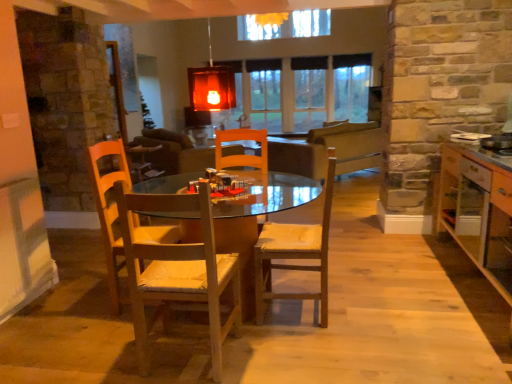
Question: Could clear glass window at center be considered to be inside wooden table at center?

Choices:
 (A) no
 (B) yes

Answer: (A)

Question: Is wooden table at center not close to clear glass window at center?

Choices:
 (A) yes
 (B) no

Answer: (A)

Question: From the image's perspective, would you say wooden table at center is positioned over clear glass window at center?

Choices:
 (A) yes
 (B) no

Answer: (B)

Question: Does wooden table at center have a smaller size compared to clear glass window at center?

Choices:
 (A) no
 (B) yes

Answer: (A)

Question: Does wooden table at center have a greater height compared to clear glass window at center?

Choices:
 (A) yes
 (B) no

Answer: (B)

Question: Is wooden table at center to the left or to the right of wooden chair with cushion at center, positioned as the 1th chair in right-to-left order, in the image?

Choices:
 (A) right
 (B) left

Answer: (B)

Question: Considering their positions, is wooden table at center located in front of or behind wooden chair with cushion at center, positioned as the 1th chair in right-to-left order?

Choices:
 (A) behind
 (B) front

Answer: (B)

Question: From the image's perspective, is wooden table at center positioned above or below wooden chair with cushion at center, positioned as the 1th chair in right-to-left order?

Choices:
 (A) below
 (B) above

Answer: (A)

Question: Would you say wooden table at center is inside or outside wooden chair with cushion at center, positioned as the 1th chair in right-to-left order?

Choices:
 (A) outside
 (B) inside

Answer: (A)

Question: In terms of size, does clear glass window at center appear bigger or smaller than wooden chair at center, the first chair viewed from the left?

Choices:
 (A) small
 (B) big

Answer: (B)

Question: From the image's perspective, is clear glass window at center located above or below wooden chair at center, marked as the second chair in a right-to-left arrangement?

Choices:
 (A) above
 (B) below

Answer: (A)

Question: Looking at their shapes, would you say clear glass window at center is wider or thinner than wooden chair at center, marked as the second chair in a right-to-left arrangement?

Choices:
 (A) thin
 (B) wide

Answer: (A)

Question: Considering the positions of point (329, 77) and point (128, 274), is point (329, 77) closer or farther from the camera than point (128, 274)?

Choices:
 (A) closer
 (B) farther

Answer: (B)

Question: From a real-world perspective, is wooden chair at center, the first chair viewed from the left, above or below clear glass window at center?

Choices:
 (A) below
 (B) above

Answer: (A)

Question: Is wooden chair at center, marked as the second chair in a right-to-left arrangement, wider or thinner than clear glass window at center?

Choices:
 (A) wide
 (B) thin

Answer: (A)